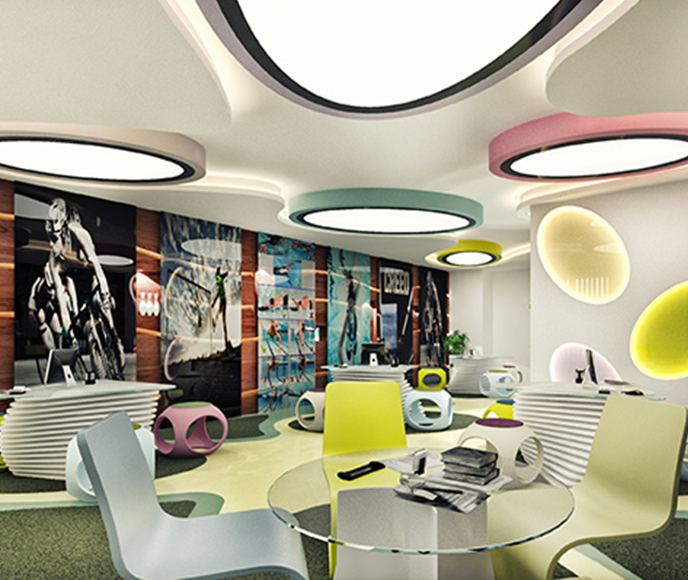
Identify the location of windows. The width and height of the screenshot is (688, 580). pyautogui.click(x=572, y=264), pyautogui.click(x=667, y=340), pyautogui.click(x=568, y=360).